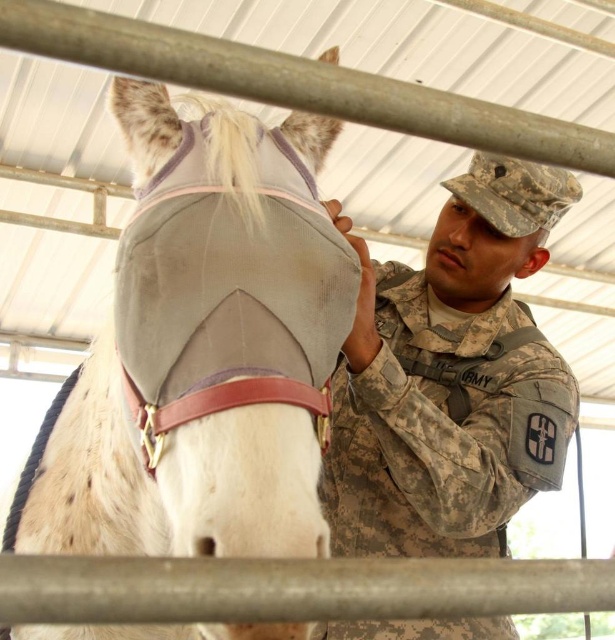
You are a photographer setting up a shoot in this stable. You need to position a light source above the gray fabric horse mask at center so it doesn not cast a shadow on the camouflage fabric cap at upper right. Given their heights, where should you place the light?

The gray fabric horse mask at center is taller than the camouflage fabric cap at upper right. To avoid casting a shadow on the cap, position the light source above and slightly behind the horse mask so its shadow falls behind the cap.

You are a photographer standing in the barn and want to take a photo of the soldier and the horse. Since the camera is at your eye level, which object, the camouflage uniform at center or the smooth skin nose at center, will appear closer to the camera in the photo?

The smooth skin nose at center will appear closer to the camera because it is positioned above the camouflage uniform at center.

You are standing in the stable and want to place a small decoration between the two points, point (335, 420) and point (454, 221). Which point should the decoration be closer to in order to appear larger from your current viewpoint?

The decoration should be placed closer to point (335, 420) because it is closer to the viewer, making objects placed there appear larger.